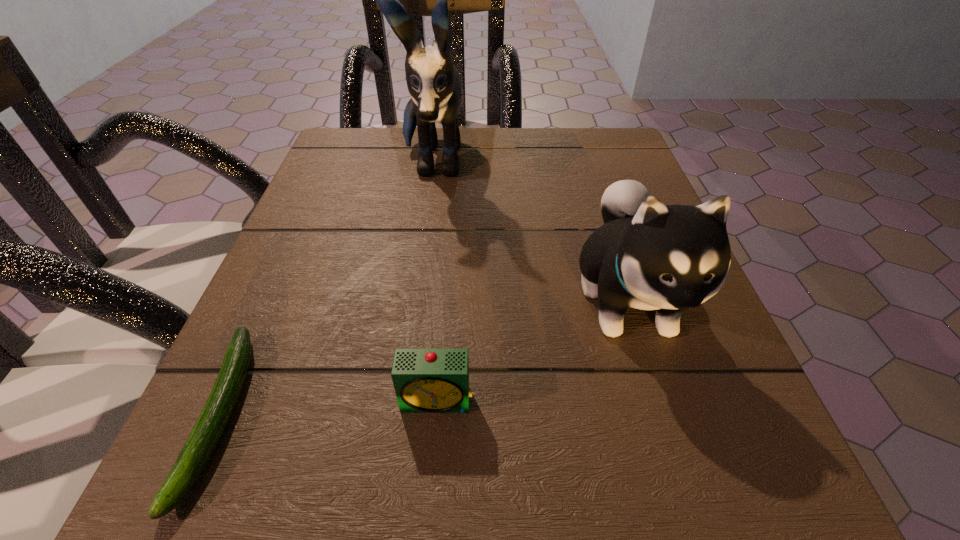
Locate an element on the screen. This screenshot has width=960, height=540. the left puppy is located at coordinates (433, 82).

Locate an element on the screen. The height and width of the screenshot is (540, 960). the farther puppy is located at coordinates (433, 82).

Identify the location of the right puppy. The image size is (960, 540). (649, 256).

Image resolution: width=960 pixels, height=540 pixels. Find the location of `the nearer puppy`. the nearer puppy is located at coordinates (649, 256).

Find the location of a particular element. The width and height of the screenshot is (960, 540). alarm clock is located at coordinates (426, 380).

Locate an element on the screen. the leftmost object is located at coordinates (208, 429).

At what (x,y) coordinates should I click in order to perform the action: click on the shortest object. Please return your answer as a coordinate pair (x, y). This screenshot has width=960, height=540. Looking at the image, I should click on (208, 429).

Where is `free space located 0.350m on the front-facing side of the tallest object`? free space located 0.350m on the front-facing side of the tallest object is located at coordinates (403, 363).

Identify the location of blank area located on the front-facing side of the third tallest object. (432, 474).

This screenshot has height=540, width=960. I want to click on object located in the far edge section of the desktop, so click(x=433, y=82).